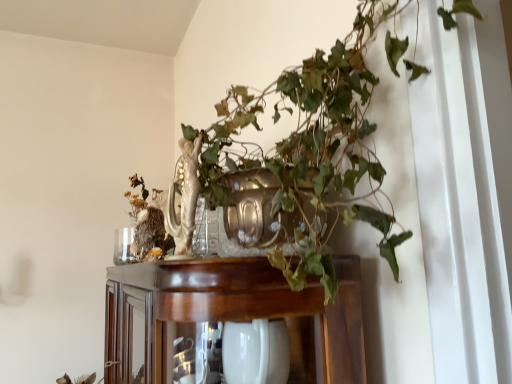
Question: Considering the relative sizes of shiny brown cabinet at center and porcelain statue at upper center in the image provided, is shiny brown cabinet at center wider than porcelain statue at upper center?

Choices:
 (A) yes
 (B) no

Answer: (A)

Question: Is shiny brown cabinet at center in contact with porcelain statue at upper center?

Choices:
 (A) no
 (B) yes

Answer: (A)

Question: From the image's perspective, is shiny brown cabinet at center over porcelain statue at upper center?

Choices:
 (A) no
 (B) yes

Answer: (A)

Question: Does shiny brown cabinet at center turn towards porcelain statue at upper center?

Choices:
 (A) no
 (B) yes

Answer: (A)

Question: From a real-world perspective, is shiny brown cabinet at center beneath porcelain statue at upper center?

Choices:
 (A) no
 (B) yes

Answer: (B)

Question: Are shiny brown cabinet at center and porcelain statue at upper center far apart?

Choices:
 (A) no
 (B) yes

Answer: (A)

Question: Does porcelain statue at upper center have a smaller size compared to shiny brown cabinet at center?

Choices:
 (A) no
 (B) yes

Answer: (B)

Question: Is porcelain statue at upper center located outside shiny brown cabinet at center?

Choices:
 (A) yes
 (B) no

Answer: (A)

Question: From the image's perspective, is porcelain statue at upper center below shiny brown cabinet at center?

Choices:
 (A) no
 (B) yes

Answer: (A)

Question: From a real-world perspective, is porcelain statue at upper center positioned over shiny brown cabinet at center based on gravity?

Choices:
 (A) yes
 (B) no

Answer: (A)

Question: Does porcelain statue at upper center have a lesser width compared to shiny brown cabinet at center?

Choices:
 (A) no
 (B) yes

Answer: (B)

Question: Would you say porcelain statue at upper center is a long distance from shiny brown cabinet at center?

Choices:
 (A) no
 (B) yes

Answer: (A)

Question: Is porcelain statue at upper center wider or thinner than shiny brown cabinet at center?

Choices:
 (A) thin
 (B) wide

Answer: (A)